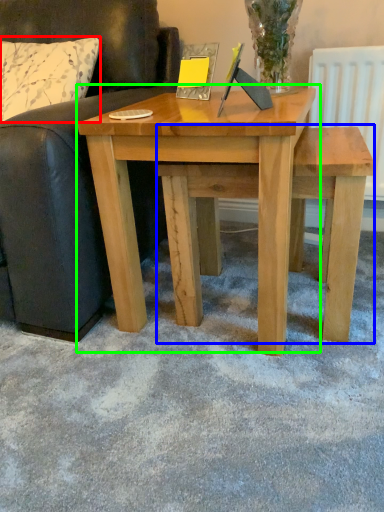
Question: Considering the real-world distances, which object is farthest from pillow (highlighted by a red box)? stool (highlighted by a blue box) or table (highlighted by a green box)?

Choices:
 (A) stool
 (B) table

Answer: (A)